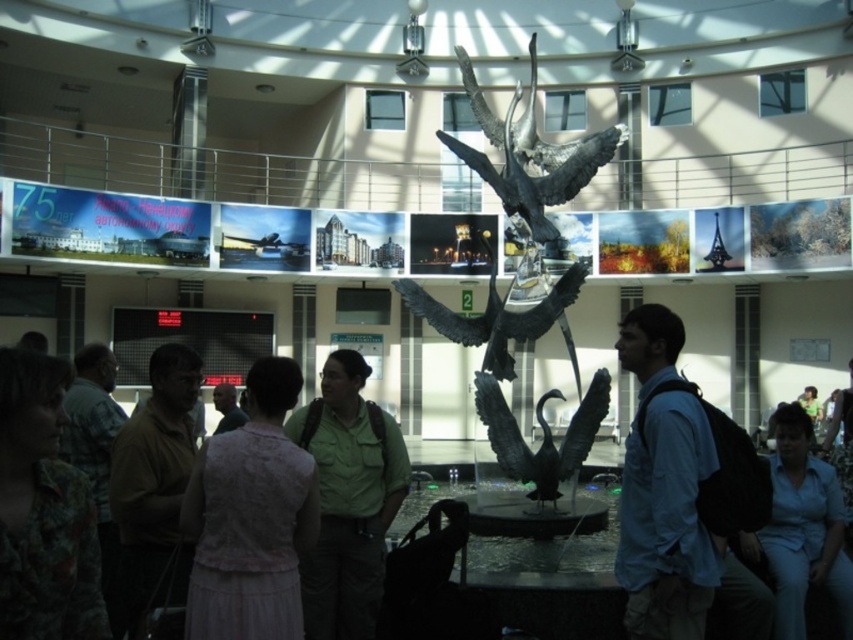
Question: Which object is closer to the camera taking this photo?

Choices:
 (A) brown fabric shirt at left
 (B) pink lace dress at center
 (C) pink fabric dress at center

Answer: (B)

Question: Which of the following is the closest to the observer?

Choices:
 (A) (315, 502)
 (B) (233, 413)
 (C) (691, 403)

Answer: (A)

Question: Considering the real-world distances, which object is farthest from the shiny bronze sculpture at center?

Choices:
 (A) pink fabric dress at center
 (B) bronze sculpture at center
 (C) brown fabric shirt at left
 (D) blue shirt at center

Answer: (C)

Question: Can you confirm if light pink fabric dress at lower left is thinner than polished bronze swan at center?

Choices:
 (A) yes
 (B) no

Answer: (B)

Question: Is shiny bronze sculpture at center in front of pink fabric dress at center?

Choices:
 (A) yes
 (B) no

Answer: (A)

Question: Can you confirm if blue shirt at center is positioned to the left of polished bronze swan at center?

Choices:
 (A) no
 (B) yes

Answer: (A)